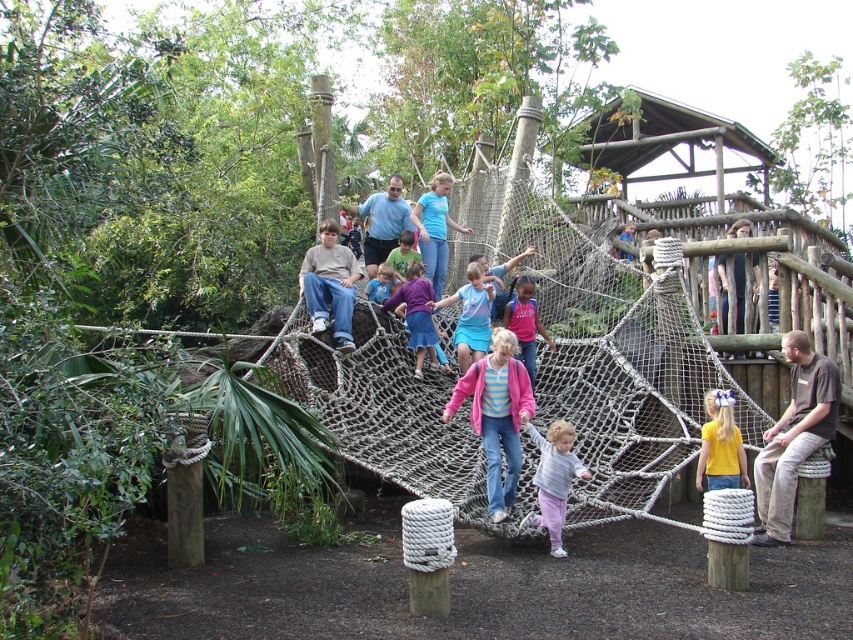
Question: Can you confirm if blue denim jeans at center is wider than matte blue shorts at center?

Choices:
 (A) no
 (B) yes

Answer: (B)

Question: Is brown cotton shirt at lower right further to camera compared to blue denim jeans at center?

Choices:
 (A) yes
 (B) no

Answer: (B)

Question: Which point appears farthest from the camera in this image?

Choices:
 (A) (763, 480)
 (B) (320, 280)

Answer: (B)

Question: Which object is positioned farthest from the purple fabric dress at center?

Choices:
 (A) pink fabric at center
 (B) pink fleece jacket at center

Answer: (B)

Question: Which object is the closest to the pink fabric at center?

Choices:
 (A) pink fleece jacket at center
 (B) blue denim jeans at center
 (C) blue t-shirt at center

Answer: (A)

Question: Can you confirm if blue t-shirt at center is smaller than purple fabric dress at center?

Choices:
 (A) no
 (B) yes

Answer: (A)